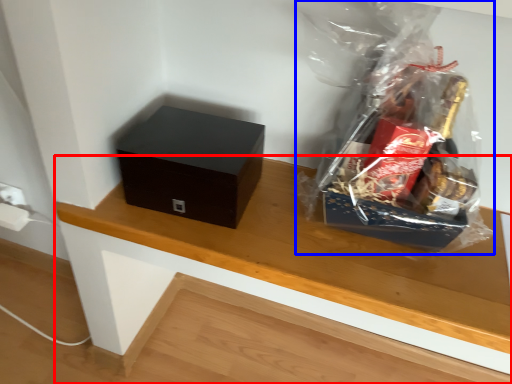
Question: Which point is further to the camera, table (highlighted by a red box) or plastic bag (highlighted by a blue box)?

Choices:
 (A) table
 (B) plastic bag

Answer: (A)